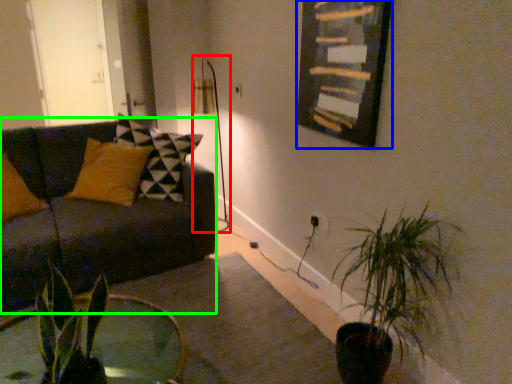
Question: Considering the real-world distances, which object is farthest from table lamp (highlighted by a red box)? picture frame (highlighted by a blue box) or studio couch (highlighted by a green box)?

Choices:
 (A) picture frame
 (B) studio couch

Answer: (A)